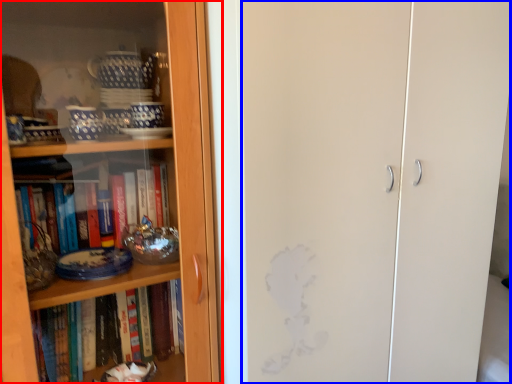
Question: Which object appears closest to the camera in this image, bookcase (highlighted by a red box) or screen door (highlighted by a blue box)?

Choices:
 (A) bookcase
 (B) screen door

Answer: (A)